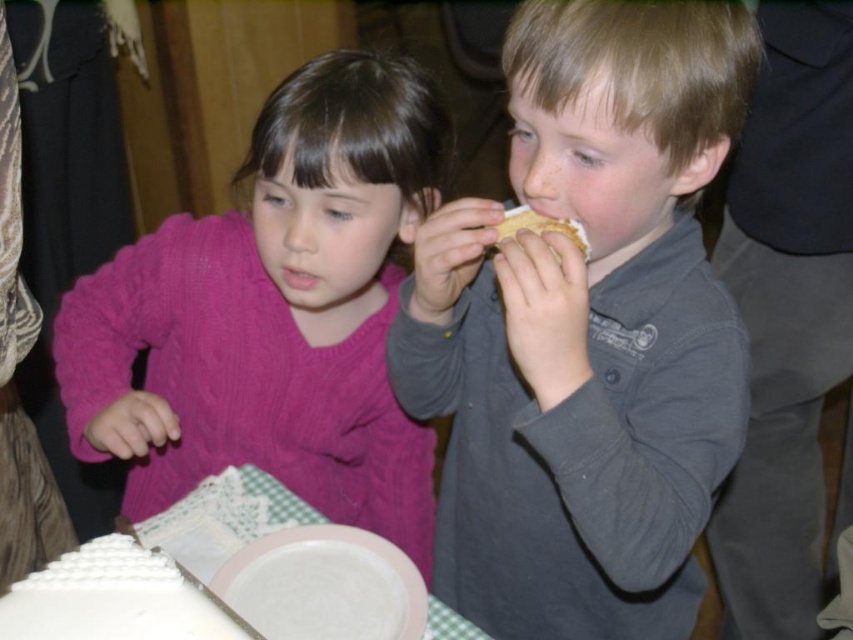
Looking at this image, you are a photographer at a birthday party. You need to capture a photo of the matte gray shirt at center and the golden crumbly pie at upper center. Based on their positions, which object should you focus on first to ensure both are in the frame?

The matte gray shirt at center is located below the golden crumbly pie at upper center, so you should focus on the golden crumbly pie at upper center first to ensure both are in the frame.

You are a photographer at a birthday party and need to adjust the camera focus. The pink knitted sweater at left and the golden crumbly pie at upper center are both in the frame. Which object should you focus on to ensure it appears larger in the photo?

The pink knitted sweater at left should be focused on because it is much taller than the golden crumbly pie at upper center, making it appear larger in the photo.